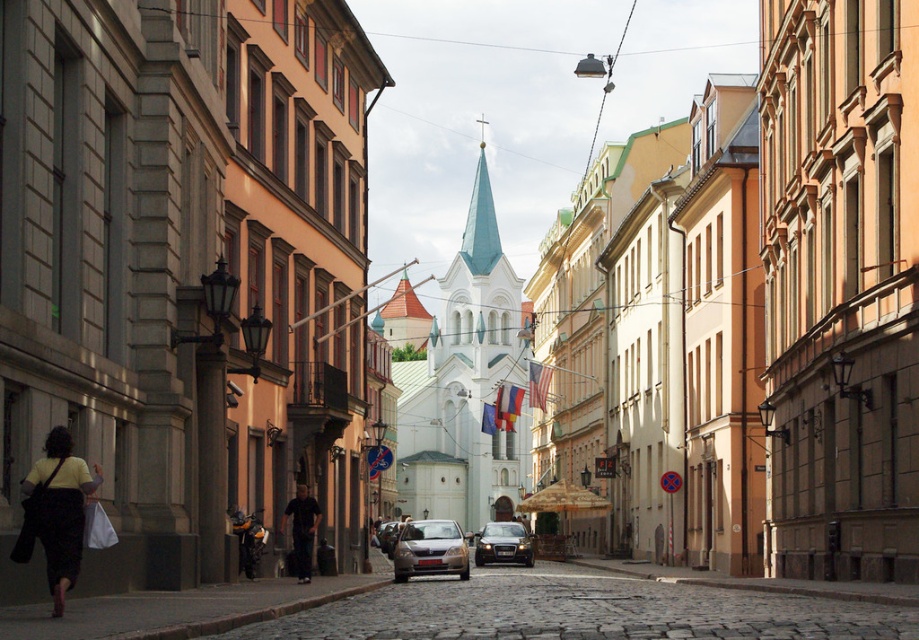
Can you confirm if dark blue jeans at center is positioned to the left of silver metallic sedan at center?

No, dark blue jeans at center is not to the left of silver metallic sedan at center.

Find the location of `dark blue jeans at center`. dark blue jeans at center is located at coordinates pyautogui.click(x=302, y=529).

Does point (482, 435) come closer to viewer compared to point (375, 536)?

No, (482, 435) is behind (375, 536).

Is white stone church at center positioned behind silver metallic sedan at center?

Yes, white stone church at center is further from the viewer.

Find the location of a particular element. white stone church at center is located at coordinates (466, 385).

Does matte yellow shirt at lower left have a larger size compared to satin silver sedan at center?

No, matte yellow shirt at lower left is not bigger than satin silver sedan at center.

Does matte yellow shirt at lower left have a lesser height compared to satin silver sedan at center?

Indeed, matte yellow shirt at lower left has a lesser height compared to satin silver sedan at center.

Between point (63, 445) and point (441, 525), which one is positioned in front?

Positioned in front is point (63, 445).

Locate an element on the screen. The width and height of the screenshot is (919, 640). matte yellow shirt at lower left is located at coordinates [55, 513].